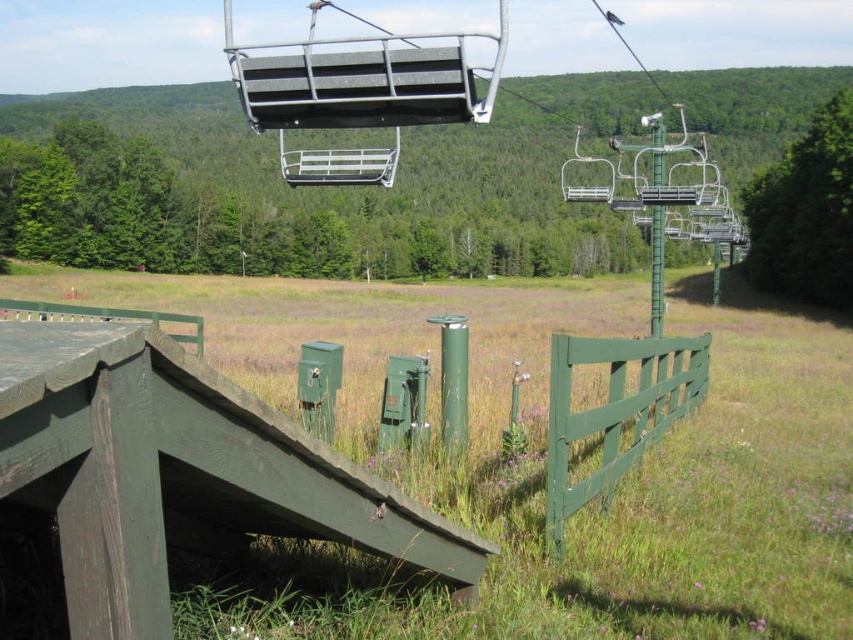
Question: Is green wood ramp at lower center positioned behind green wooden fence at lower right?

Choices:
 (A) yes
 (B) no

Answer: (B)

Question: Which of the following is the closest to the observer?

Choices:
 (A) (648, 369)
 (B) (200, 385)

Answer: (B)

Question: Does green wood ramp at lower center appear under green wooden fence at lower right?

Choices:
 (A) no
 (B) yes

Answer: (A)

Question: Among these objects, which one is farthest from the camera?

Choices:
 (A) green wooden fence at lower right
 (B) green wood ramp at lower center

Answer: (A)

Question: Is green wood ramp at lower center further to camera compared to green wooden fence at lower right?

Choices:
 (A) yes
 (B) no

Answer: (B)

Question: Which point is closer to the camera?

Choices:
 (A) green wooden fence at lower right
 (B) green wood ramp at lower center

Answer: (B)